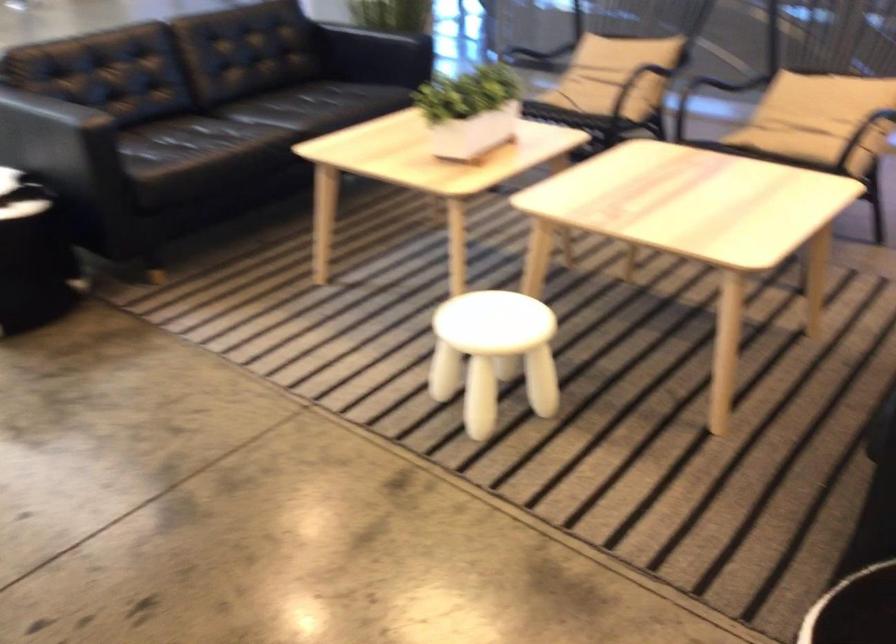
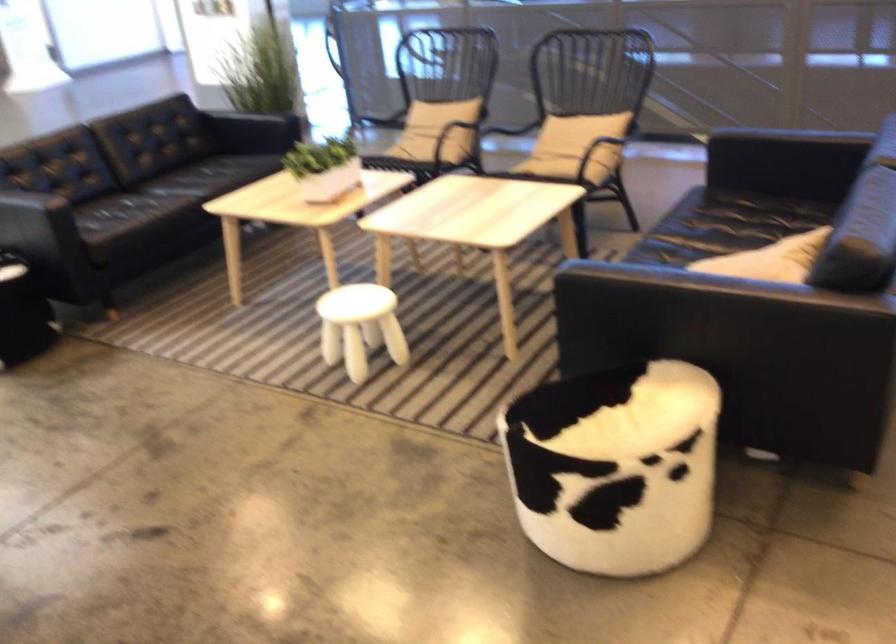
The point at (645,90) is marked in the first image. Where is the corresponding point in the second image?

(450, 135)